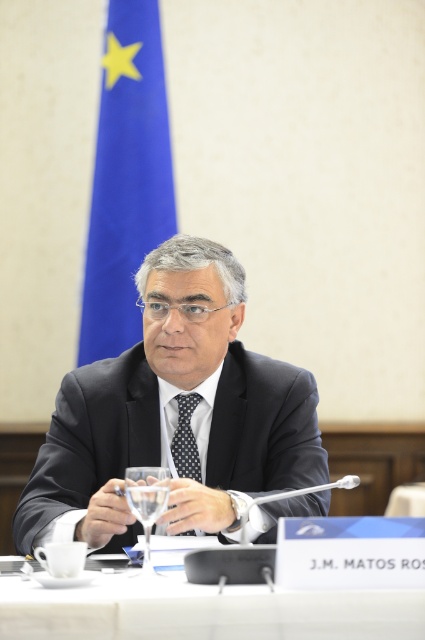
You are a photographer positioned in the room and want to take a photo of the dark gray suit at center and the blue fabric flag at upper left. To ensure both are in frame, should you adjust your camera to focus more on the left or the right side?

The dark gray suit at center is to the right of the blue fabric flag at upper left, so to include both in the frame, you should adjust your camera to focus more on the right side where the dark gray suit at center is located to ensure the blue fabric flag at upper left is also captured.